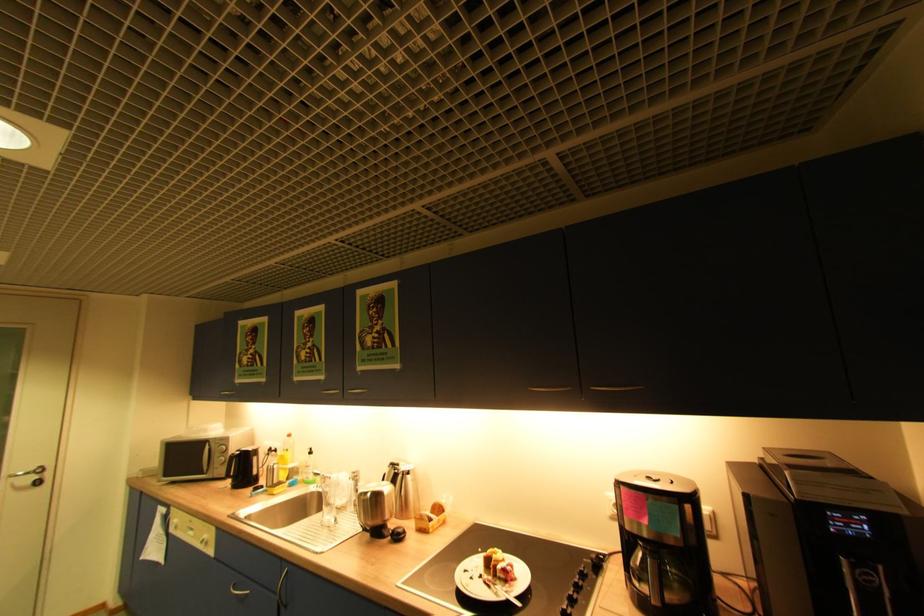
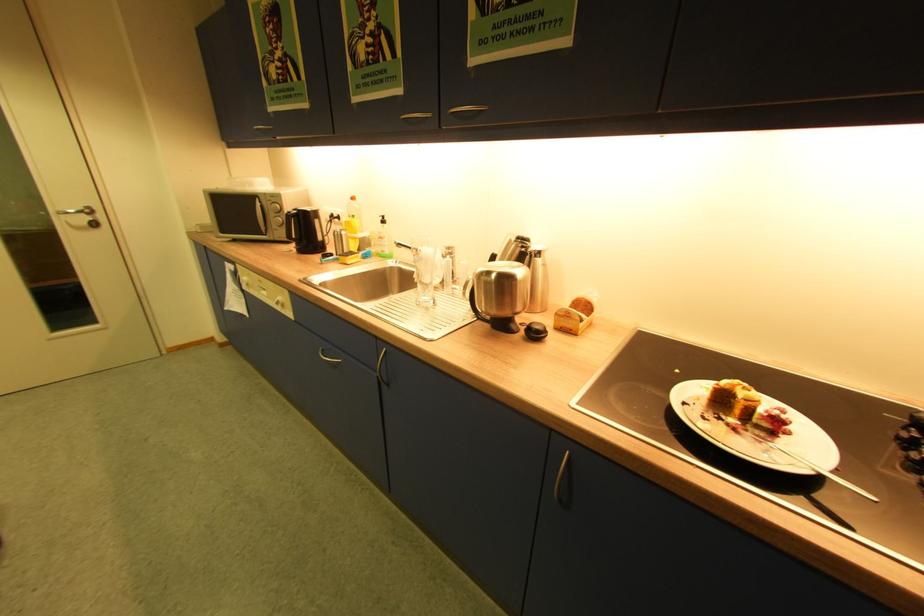
In the second image, find the point that corresponds to the point at 320,472 in the first image.

(400, 243)